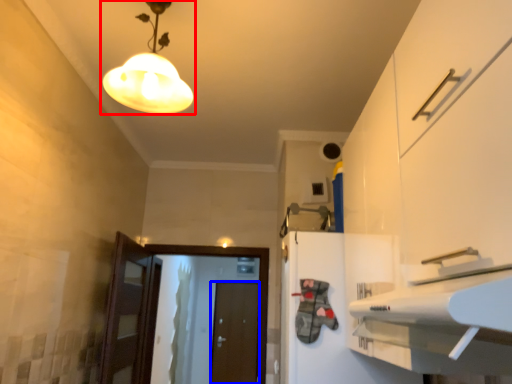
Question: Which object appears closest to the camera in this image, lamp (highlighted by a red box) or door (highlighted by a blue box)?

Choices:
 (A) lamp
 (B) door

Answer: (A)